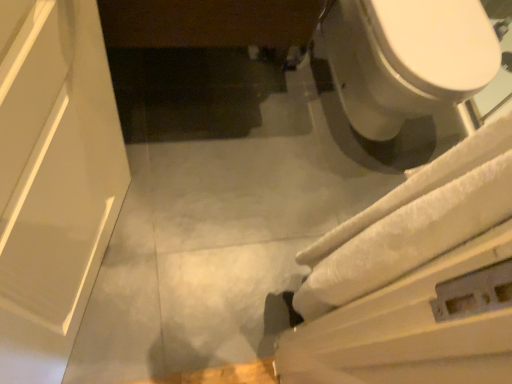
Question: Is the surface of white glossy toilet at upper right in direct contact with white textured bath towel at right?

Choices:
 (A) no
 (B) yes

Answer: (A)

Question: Could you tell me if white glossy toilet at upper right is facing white textured bath towel at right?

Choices:
 (A) no
 (B) yes

Answer: (A)

Question: Can you confirm if white glossy toilet at upper right is wider than white textured bath towel at right?

Choices:
 (A) no
 (B) yes

Answer: (B)

Question: Considering the relative sizes of white glossy toilet at upper right and white textured bath towel at right in the image provided, is white glossy toilet at upper right taller than white textured bath towel at right?

Choices:
 (A) yes
 (B) no

Answer: (A)

Question: Is white glossy toilet at upper right behind white textured bath towel at right?

Choices:
 (A) yes
 (B) no

Answer: (A)

Question: Is white glossy toilet at upper right to the right of white textured bath towel at right from the viewer's perspective?

Choices:
 (A) yes
 (B) no

Answer: (A)

Question: Does white textured bath towel at right have a lesser width compared to white glossy toilet at upper right?

Choices:
 (A) yes
 (B) no

Answer: (A)

Question: Is white textured bath towel at right turned away from white glossy toilet at upper right?

Choices:
 (A) yes
 (B) no

Answer: (B)

Question: Is white textured bath towel at right located outside white glossy toilet at upper right?

Choices:
 (A) no
 (B) yes

Answer: (B)

Question: Is white textured bath towel at right directly adjacent to white glossy toilet at upper right?

Choices:
 (A) yes
 (B) no

Answer: (B)

Question: Considering the relative sizes of white textured bath towel at right and white glossy toilet at upper right in the image provided, is white textured bath towel at right smaller than white glossy toilet at upper right?

Choices:
 (A) yes
 (B) no

Answer: (A)

Question: Is white textured bath towel at right behind white glossy toilet at upper right?

Choices:
 (A) yes
 (B) no

Answer: (B)

Question: In terms of size, does white glossy toilet at upper right appear bigger or smaller than white textured bath towel at right?

Choices:
 (A) big
 (B) small

Answer: (A)